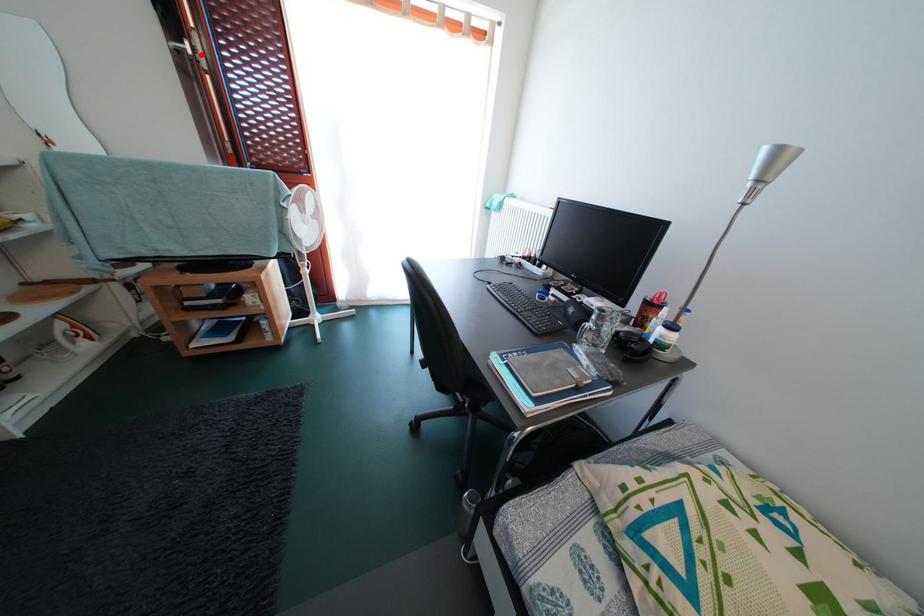
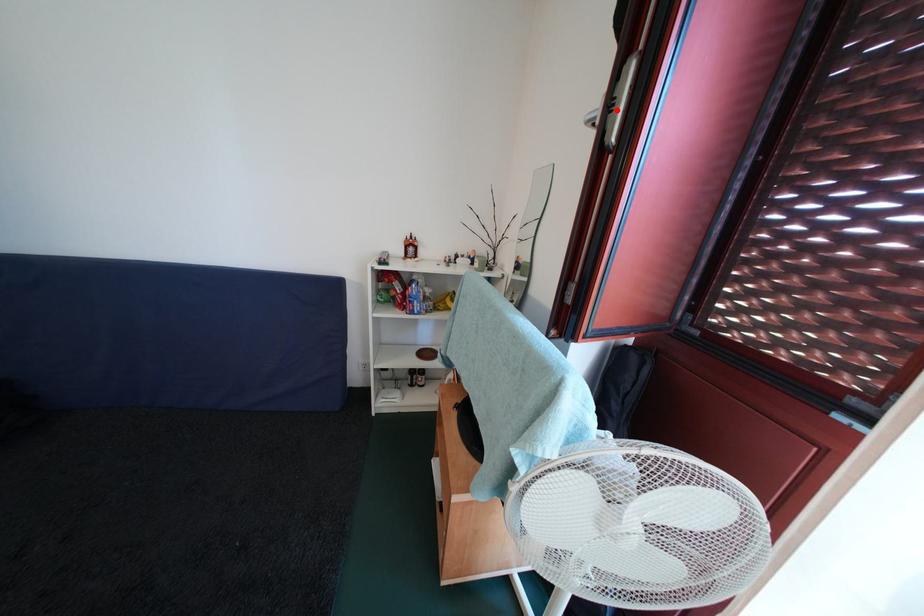
I am providing you with two images of the same scene from different viewpoints. A red point is marked on the first image and another point is marked on the second image. Are the points marked in image1 and image2 representing the same 3D position?

Yes